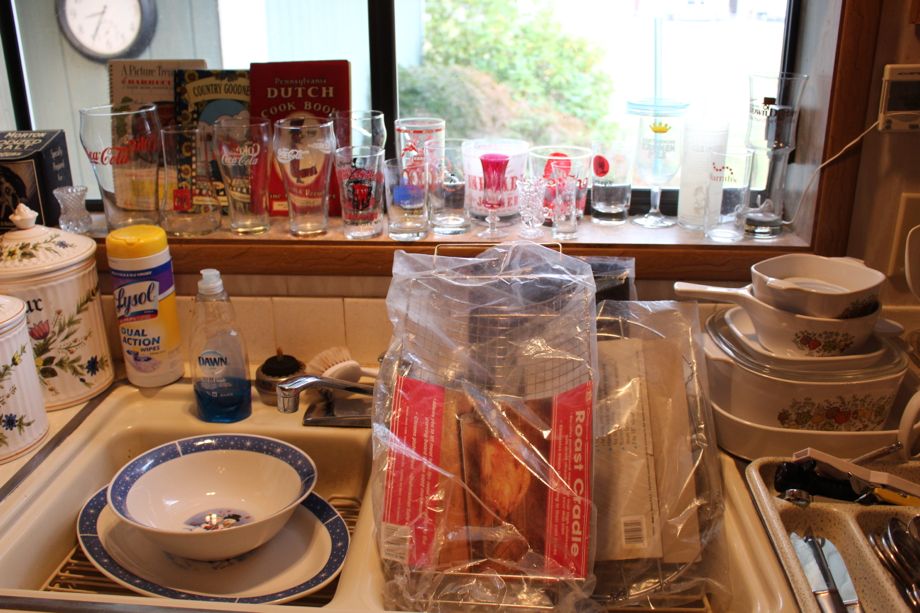
Locate an element on the screen. Image resolution: width=920 pixels, height=613 pixels. sink basins is located at coordinates (749, 592), (58, 535).